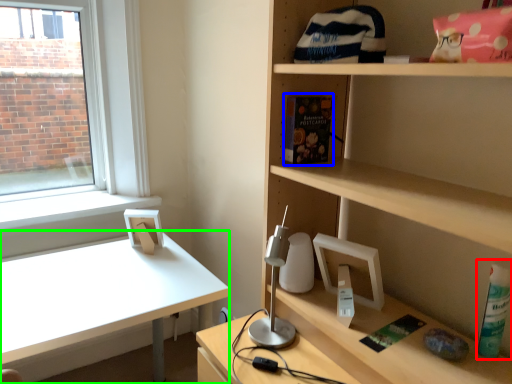
Question: Which is nearer to the bottle (highlighted by a red box)? book (highlighted by a blue box) or desk (highlighted by a green box).

Choices:
 (A) book
 (B) desk

Answer: (A)